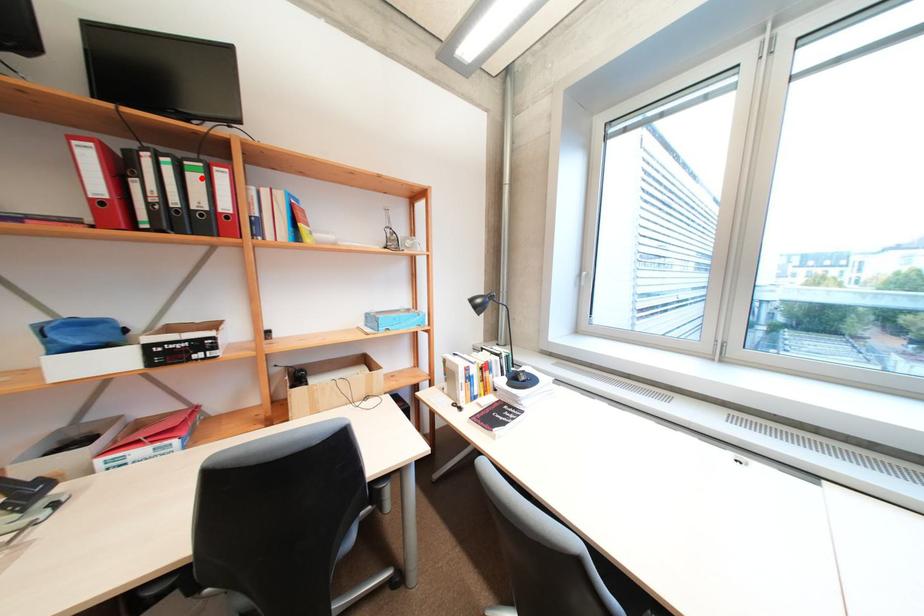
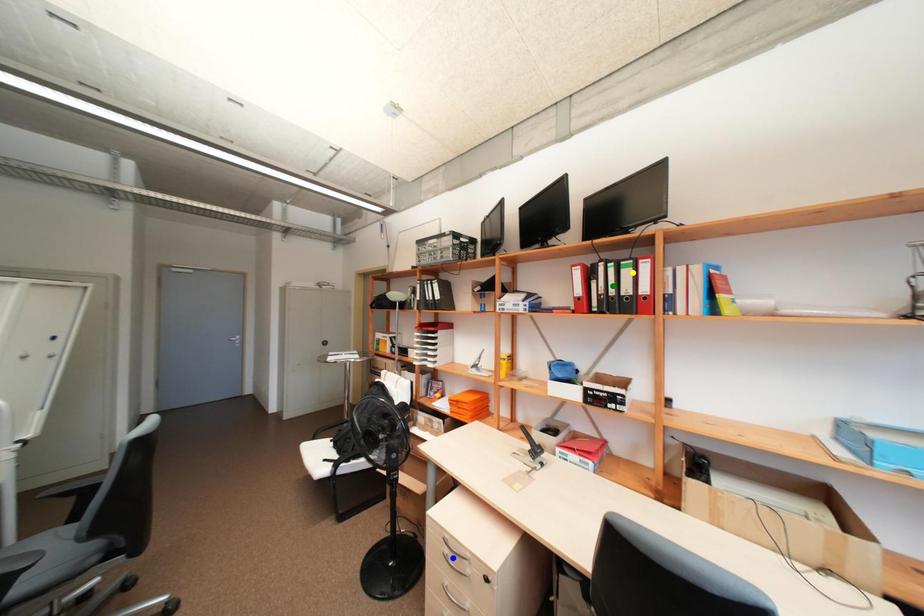
Question: I am providing you with two images of the same scene from different viewpoints. A red point is marked on the first image. You are given multiple points on the second image. Can you choose the point in image 2 that corresponds to the point in image 1?

Choices:
 (A) blue point
 (B) yellow point
 (C) green point

Answer: (B)